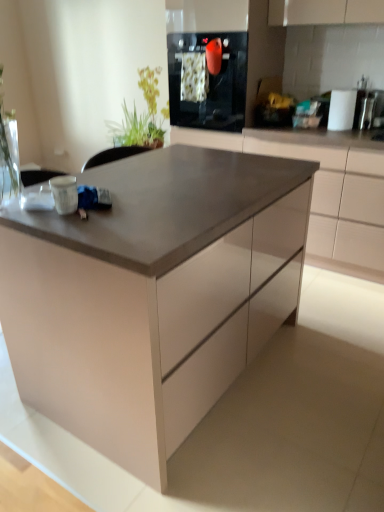
This screenshot has height=512, width=384. What are the coordinates of `free space above matte gray table at center (from a real-world perspective)` in the screenshot? It's located at (179, 178).